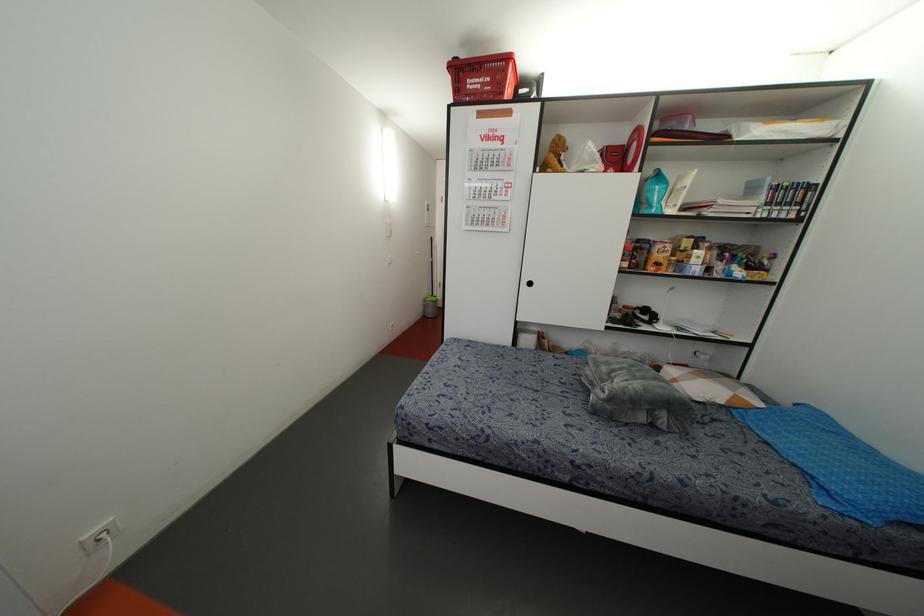
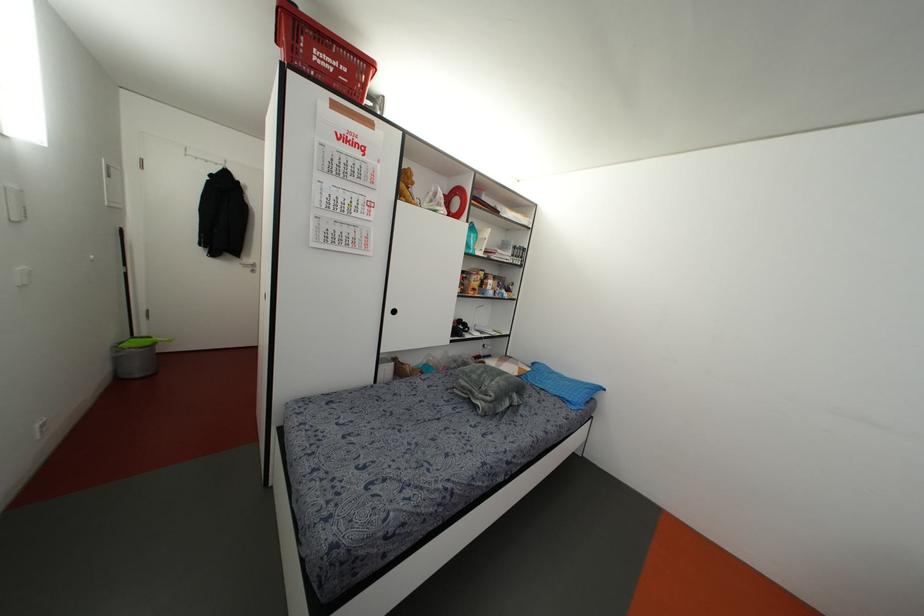
Where in the second image is the point corresponding to [472,83] from the first image?

(322, 59)